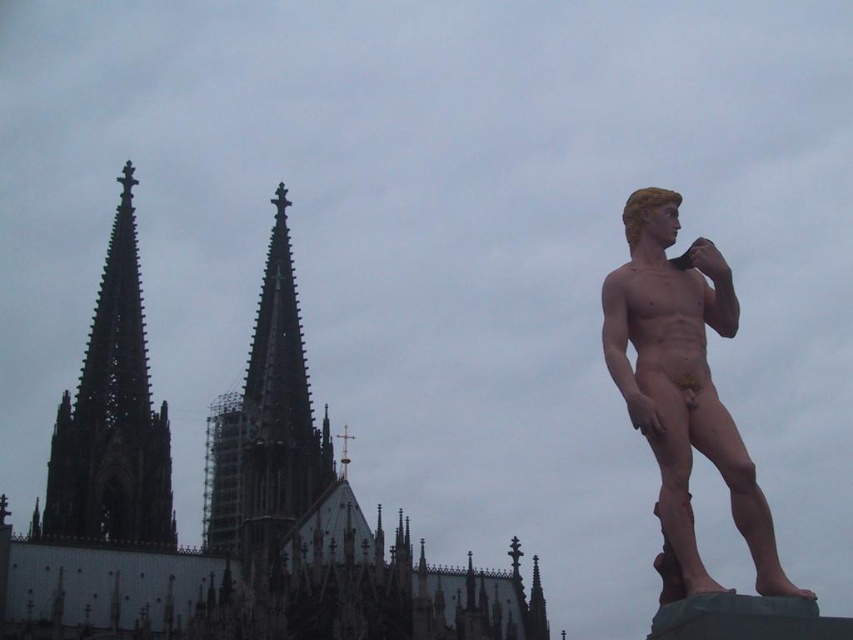
You are an art student analyzing the composition of this image. You notice the matte bronze statue at right and the dark gray stone spire at center. Which object is located to the right of the other?

The matte bronze statue at right is positioned on the right side of the dark gray stone spire at center.

You are an art student analyzing the composition of the image. The matte bronze statue at right and the dark gray stone spire at center are both central to the artwork. Based on their positions, which object appears higher in the image?

The matte bronze statue at right is positioned above the dark gray stone spire at center, so it appears higher in the image.